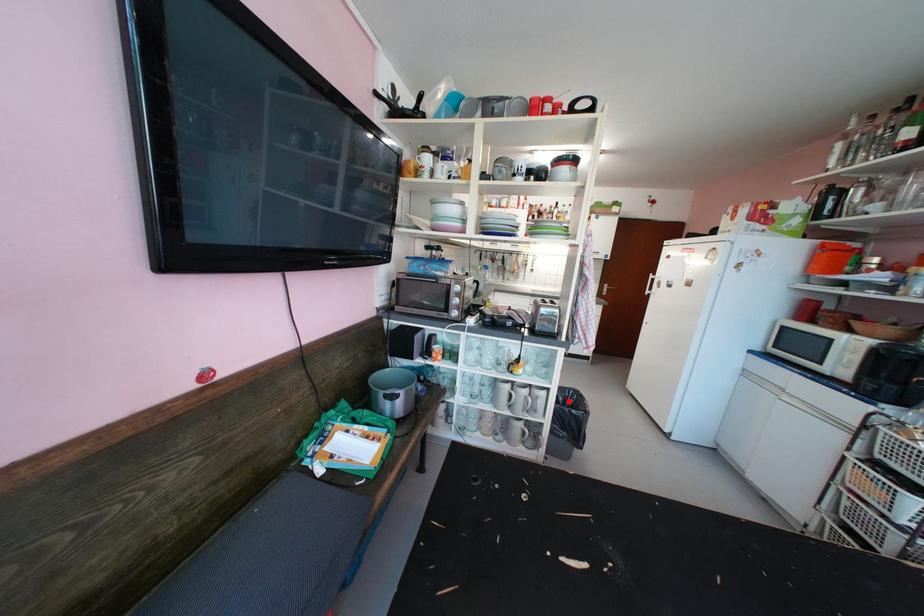
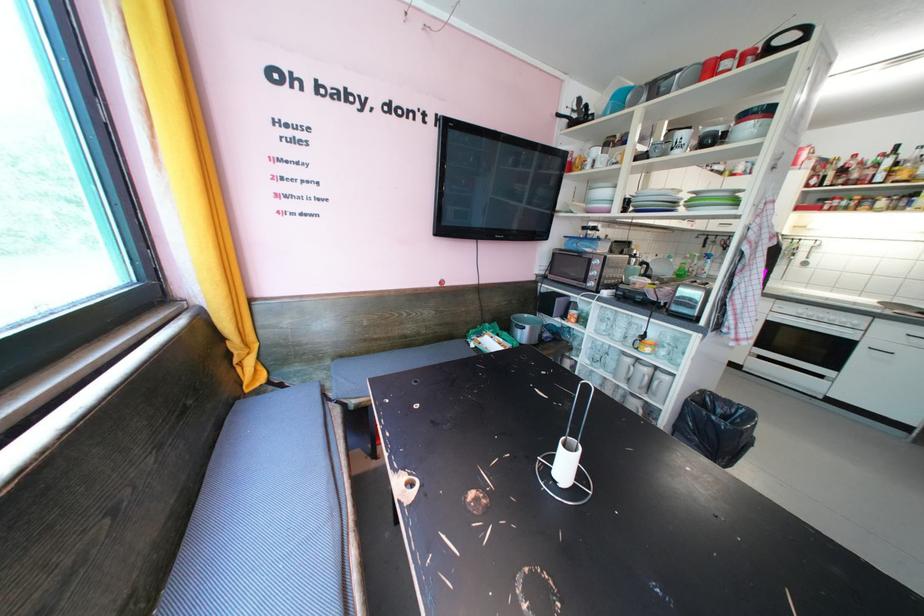
Question: I am providing you with two images of the same scene from different viewpoints. In image1, a red point is highlighted. Considering the same 3D point in image2, which of the following is correct?

Choices:
 (A) It is closer
 (B) It is farther

Answer: (A)